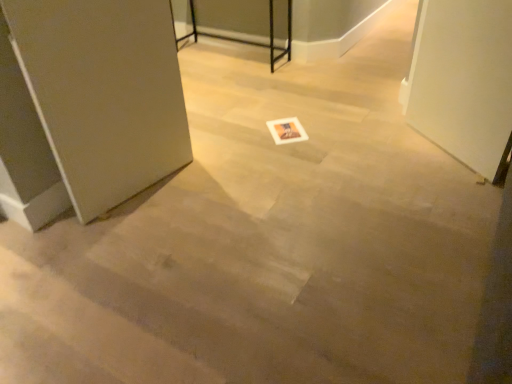
Question: In terms of width, does metallic black table at upper center look wider or thinner when compared to white paper postcard at center?

Choices:
 (A) thin
 (B) wide

Answer: (B)

Question: Is point (271, 41) positioned closer to the camera than point (288, 130)?

Choices:
 (A) farther
 (B) closer

Answer: (A)

Question: Estimate the real-world distances between objects in this image. Which object is farther from the metallic black table at upper center?

Choices:
 (A) satin silver door at left
 (B) white glossy screen door at right
 (C) white paper postcard at center

Answer: (A)

Question: Estimate the real-world distances between objects in this image. Which object is closer to the metallic black table at upper center?

Choices:
 (A) white glossy screen door at right
 (B) satin silver door at left
 (C) white paper postcard at center

Answer: (C)